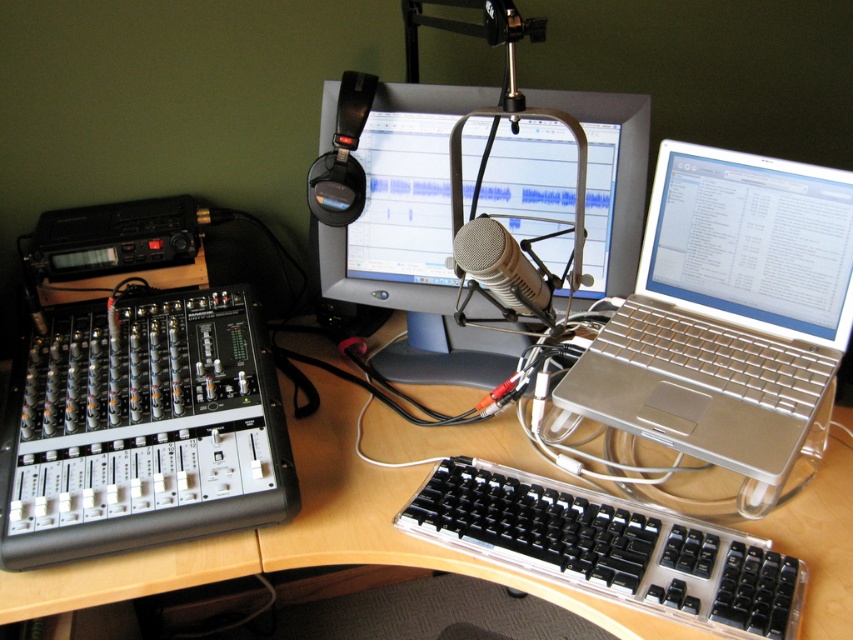
Question: In this image, where is silver metallic laptop at right located relative to silver metallic microphone at center?

Choices:
 (A) above
 (B) below

Answer: (B)

Question: Which point is closer to the camera taking this photo?

Choices:
 (A) (503, 182)
 (B) (685, 557)
 (C) (769, 196)
 (D) (512, 276)

Answer: (B)

Question: Which object is positioned closest to the clear plastic keyboard at center?

Choices:
 (A) silver metallic microphone at center
 (B) silver metallic laptop at right

Answer: (B)

Question: Which point is closer to the camera?

Choices:
 (A) (521, 141)
 (B) (634, 339)
 (C) (621, 532)

Answer: (C)

Question: Does silver metallic laptop at center have a larger size compared to clear plastic keyboard at center?

Choices:
 (A) yes
 (B) no

Answer: (A)

Question: Considering the relative positions of silver metallic laptop at center and silver metallic microphone at center in the image provided, where is silver metallic laptop at center located with respect to silver metallic microphone at center?

Choices:
 (A) left
 (B) right

Answer: (A)